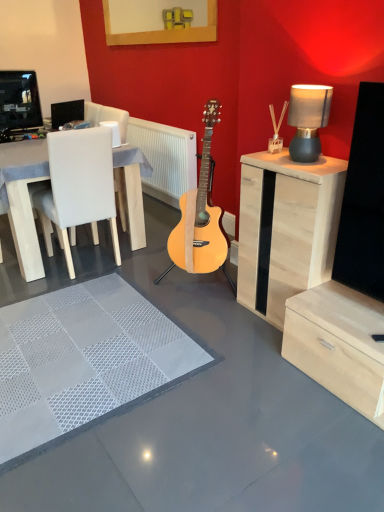
Question: Looking at the image, does white textured rug at center seem bigger or smaller compared to white textured radiator at center?

Choices:
 (A) big
 (B) small

Answer: (B)

Question: Considering the positions of point (155, 370) and point (134, 123), is point (155, 370) closer or farther from the camera than point (134, 123)?

Choices:
 (A) farther
 (B) closer

Answer: (B)

Question: Which object is the closest to the black plastic speaker at upper left?

Choices:
 (A) light wood acoustic guitar at center
 (B) white textured radiator at center
 (C) wooden picture frame at upper center
 (D) white textured rug at center
 (E) matte gray lampshade at upper right

Answer: (C)

Question: Which is nearer to the wooden picture frame at upper center?

Choices:
 (A) white textured rug at center
 (B) black plastic speaker at upper left
 (C) light wood acoustic guitar at center
 (D) matte gray lampshade at upper right
 (E) white leather chair at left

Answer: (B)